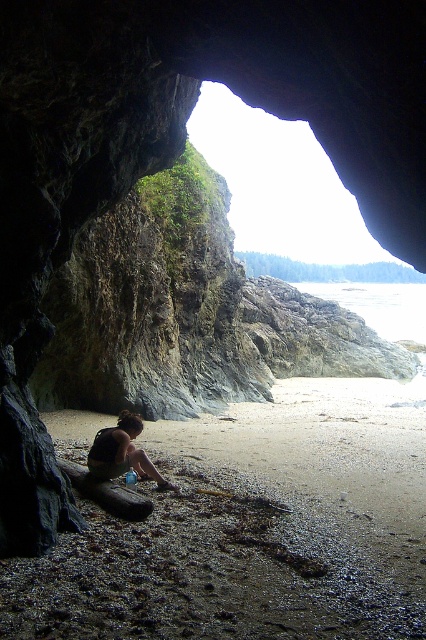
Can you confirm if sandy beach at lower center is bigger than dark brown skin at center?

Indeed, sandy beach at lower center has a larger size compared to dark brown skin at center.

The height and width of the screenshot is (640, 426). I want to click on sandy beach at lower center, so click(x=253, y=529).